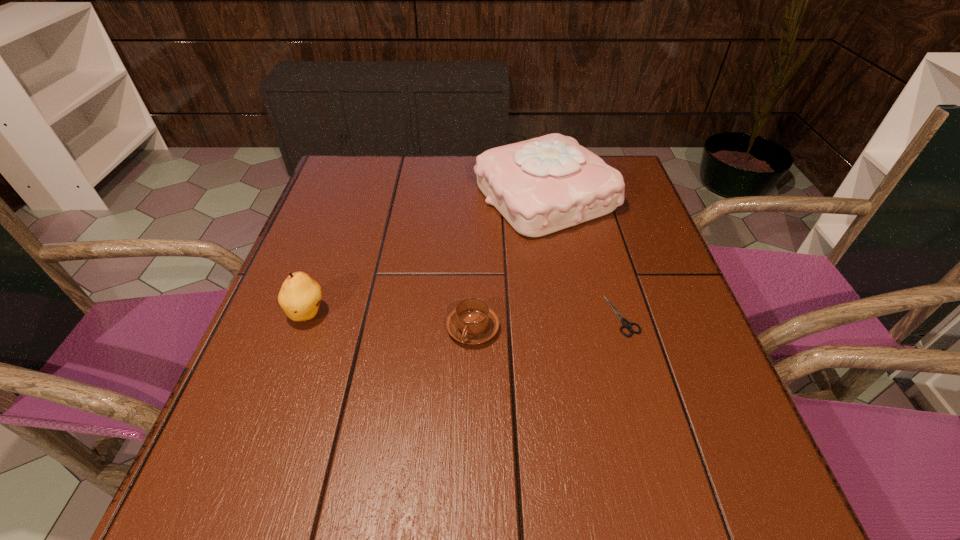
Where is `vacant space that's between the third tallest object and the cake`? The width and height of the screenshot is (960, 540). vacant space that's between the third tallest object and the cake is located at coordinates [x=509, y=262].

At what (x,y) coordinates should I click in order to perform the action: click on empty space between the leftmost object and the cappuccino. Please return your answer as a coordinate pair (x, y). Looking at the image, I should click on (391, 320).

What are the coordinates of `free point between the tallest object and the third tallest object` in the screenshot? It's located at (509, 262).

The width and height of the screenshot is (960, 540). Identify the location of empty space between the cappuccino and the third shortest object. click(x=391, y=320).

Identify the location of vacant area that lies between the leftmost object and the second shortest object. The image size is (960, 540). (391, 320).

At what (x,y) coordinates should I click in order to perform the action: click on object that ranks as the second closest to the second shortest object. Please return your answer as a coordinate pair (x, y). The image size is (960, 540). Looking at the image, I should click on (626, 324).

Where is `object that stands as the third closest to the farthest object`? object that stands as the third closest to the farthest object is located at coordinates (300, 296).

This screenshot has height=540, width=960. Identify the location of vacant area that satisfies the following two spatial constraints: 1. on the front side of the pear; 2. on the right side of the shortest object. (307, 315).